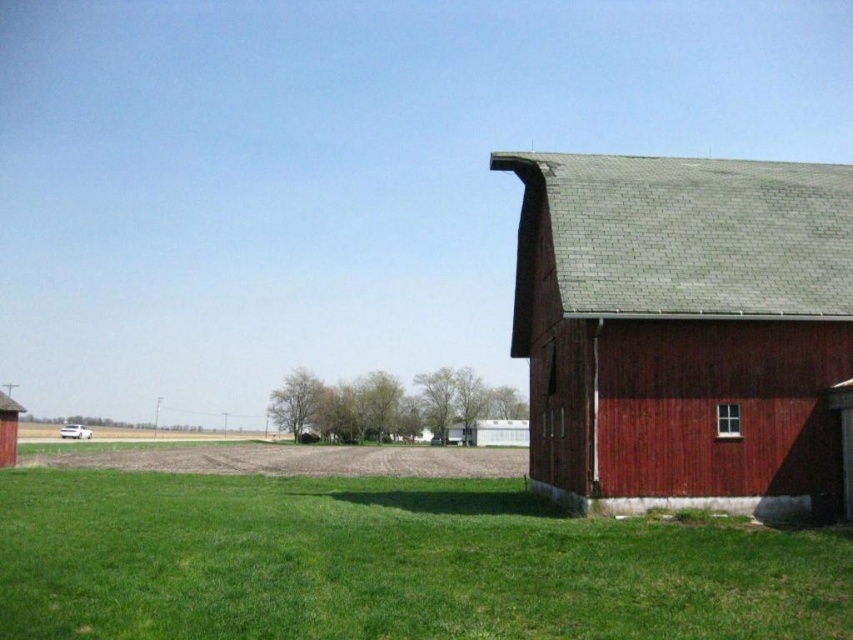
Question: Is smooth red barn at right wider than rustic wood barn at lower left?

Choices:
 (A) yes
 (B) no

Answer: (A)

Question: Which object is farther from the camera taking this photo?

Choices:
 (A) rustic wood barn at lower left
 (B) smooth red barn at right

Answer: (A)

Question: Considering the relative positions of smooth red barn at right and rustic wood barn at lower left in the image provided, where is smooth red barn at right located with respect to rustic wood barn at lower left?

Choices:
 (A) below
 (B) above

Answer: (B)

Question: Which of the following is the farthest from the observer?

Choices:
 (A) (811, 234)
 (B) (447, 481)
 (C) (4, 456)

Answer: (C)

Question: Estimate the real-world distances between objects in this image. Which object is closer to the rustic wood barn at lower left?

Choices:
 (A) green grass at lower right
 (B) smooth red barn at right

Answer: (A)

Question: Is smooth red barn at right behind rustic wood barn at lower left?

Choices:
 (A) yes
 (B) no

Answer: (B)